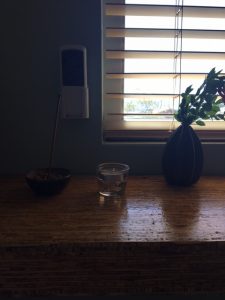
In order to click on green plant in this screenshot , I will do `click(194, 110)`.